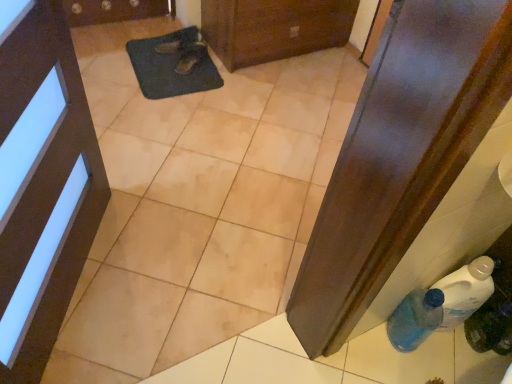
Where is `empty space that is in between matte black door at upper left, marked as the 1th door in a left-to-right arrangement, and blue translucent bottle at lower right, positioned as the second bottle in left-to-right order`? empty space that is in between matte black door at upper left, marked as the 1th door in a left-to-right arrangement, and blue translucent bottle at lower right, positioned as the second bottle in left-to-right order is located at coordinates (223, 311).